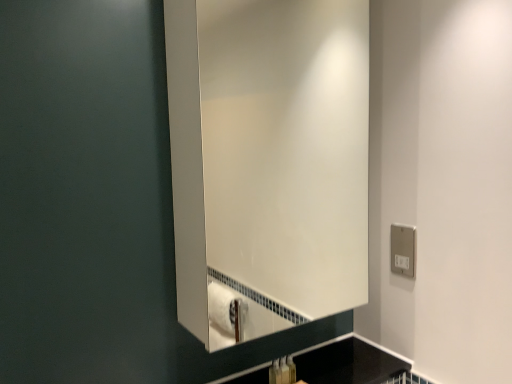
Question: In the image, is silver metallic electric outlet at right positioned in front of or behind black glossy countertop at lower center?

Choices:
 (A) front
 (B) behind

Answer: (B)

Question: From a real-world perspective, is silver metallic electric outlet at right positioned above or below black glossy countertop at lower center?

Choices:
 (A) below
 (B) above

Answer: (B)

Question: Which of these objects is positioned closest to the silver metallic electric outlet at right?

Choices:
 (A) black glossy countertop at lower center
 (B) matte plastic toothbrush at lower center, which appears as the second toiletry when viewed from the left
 (C) white glossy mirror at center
 (D) translucent plastic soap dispenser at lower center, the 2th toiletry viewed from the right

Answer: (A)

Question: Which of these objects is positioned farthest from the silver metallic electric outlet at right?

Choices:
 (A) black glossy countertop at lower center
 (B) white glossy mirror at center
 (C) matte plastic toothbrush at lower center, which appears as the second toiletry when viewed from the left
 (D) translucent plastic soap dispenser at lower center, the 2th toiletry viewed from the right

Answer: (B)